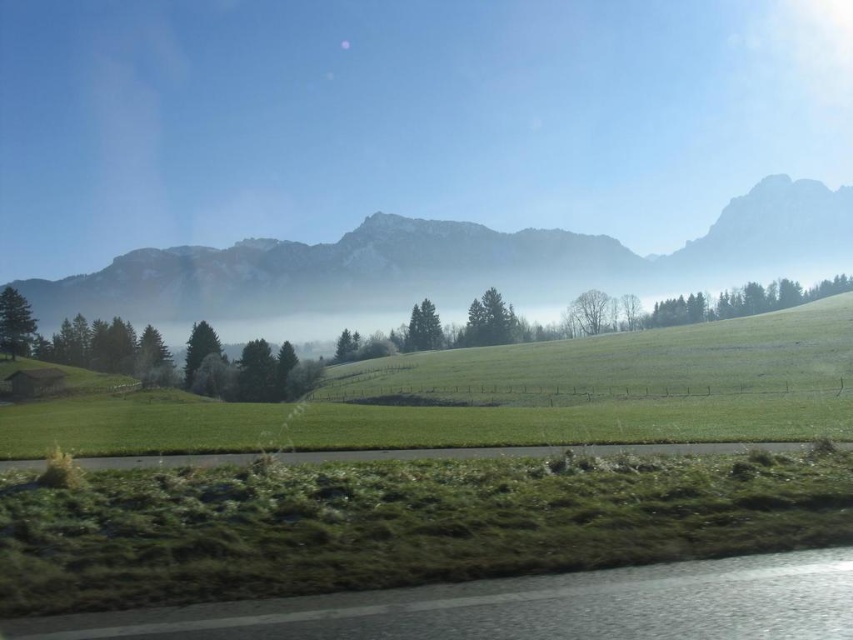
From the picture: Who is positioned more to the right, rocky gray mountain at center or gray asphalt road at lower center?

rocky gray mountain at center

Does point (512, 275) come closer to viewer compared to point (587, 448)?

That is False.

Locate an element on the screen. The width and height of the screenshot is (853, 640). rocky gray mountain at center is located at coordinates pyautogui.click(x=445, y=269).

At what (x,y) coordinates should I click in order to perform the action: click on rocky gray mountain at center. Please return your answer as a coordinate pair (x, y). Looking at the image, I should click on (445, 269).

Is point (329, 636) farther from viewer compared to point (782, 449)?

That is False.

Does point (712, 564) come behind point (399, 451)?

No.

You are a GUI agent. You are given a task and a screenshot of the screen. Output one action in this format:
    pyautogui.click(x=<x>, y=<y>)
    Task: Click on the black asphalt highway at lower left
    This screenshot has height=640, width=853.
    Given the screenshot: What is the action you would take?
    pyautogui.click(x=524, y=608)

Does rocky gray mountain at center have a greater height compared to black asphalt highway at lower left?

Indeed, rocky gray mountain at center has a greater height compared to black asphalt highway at lower left.

Find the location of a particular element. This screenshot has width=853, height=640. rocky gray mountain at center is located at coordinates (445, 269).

The height and width of the screenshot is (640, 853). I want to click on rocky gray mountain at center, so click(x=445, y=269).